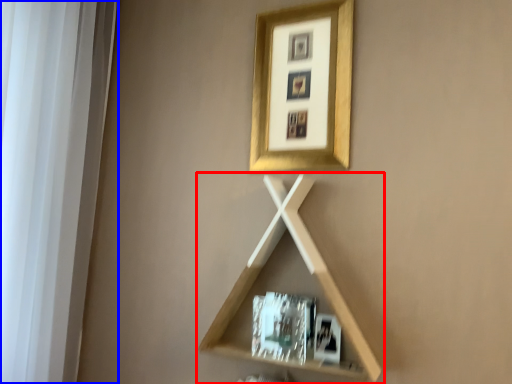
Question: Among these objects, which one is nearest to the camera, shelf (highlighted by a red box) or window frame (highlighted by a blue box)?

Choices:
 (A) shelf
 (B) window frame

Answer: (B)